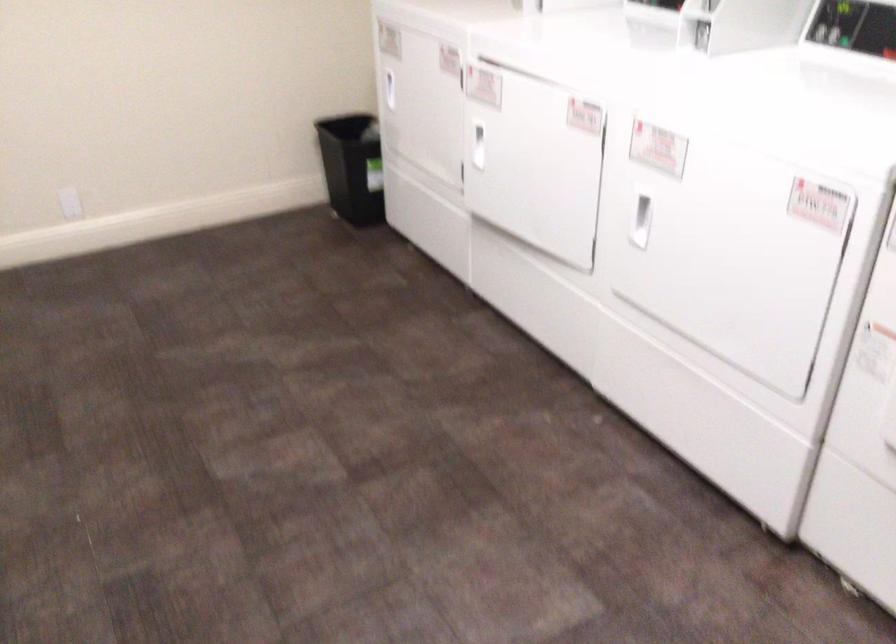
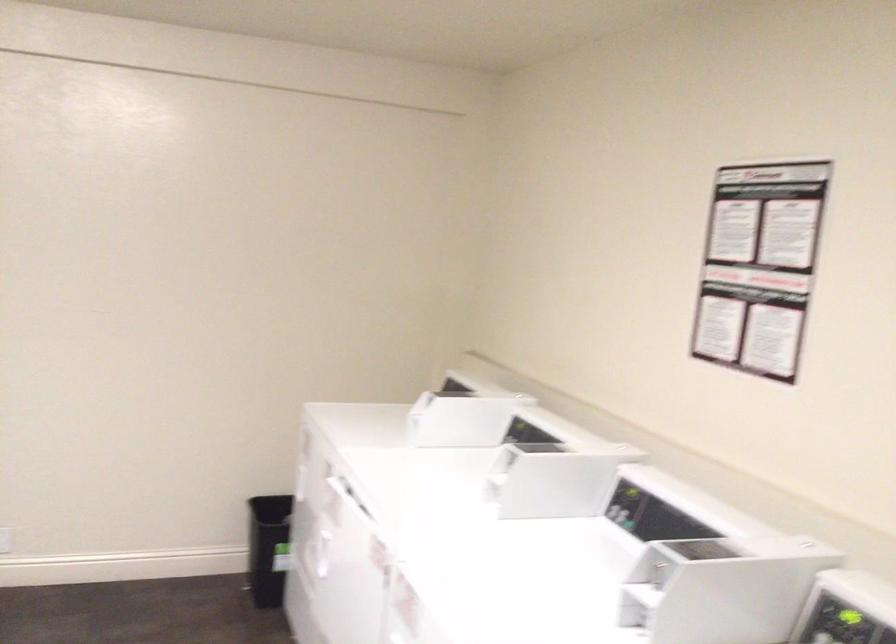
Question: In a continuous first-person perspective shot, in which direction is the camera moving?

Choices:
 (A) Left
 (B) Right
 (C) Forward
 (D) Backward

Answer: (B)